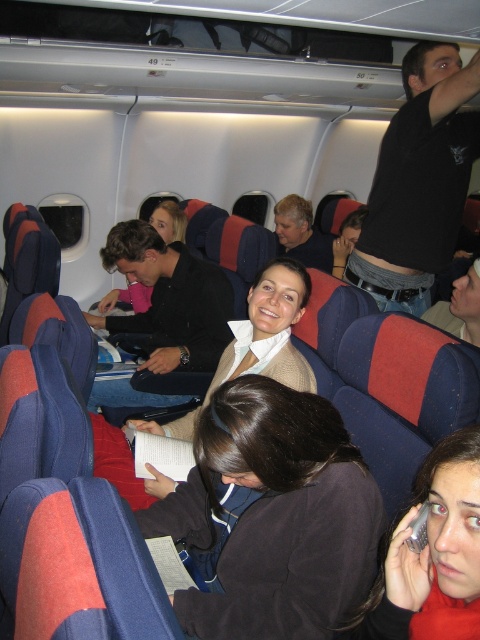
Question: Which of the following is the farthest from the observer?

Choices:
 (A) matte beige sweater at center
 (B) matte black jacket at center
 (C) dark brown fabric at center
 (D) black cotton shirt at upper center

Answer: (B)

Question: Does dark brown fabric at center appear on the right side of matte black jacket at center?

Choices:
 (A) no
 (B) yes

Answer: (B)

Question: Which point is farther to the camera?

Choices:
 (A) matte black jacket at center
 (B) dark brown fabric at center
 (C) matte black hair at center
 (D) black cotton shirt at upper center

Answer: (A)

Question: Which object appears closest to the camera in this image?

Choices:
 (A) black cotton shirt at upper center
 (B) matte black jacket at center
 (C) matte black hair at center
 (D) matte beige sweater at center

Answer: (C)

Question: Is black cotton shirt at upper center below matte black jacket at center?

Choices:
 (A) yes
 (B) no

Answer: (B)

Question: Can you confirm if dark brown fabric at center is bigger than black cotton shirt at upper center?

Choices:
 (A) no
 (B) yes

Answer: (A)